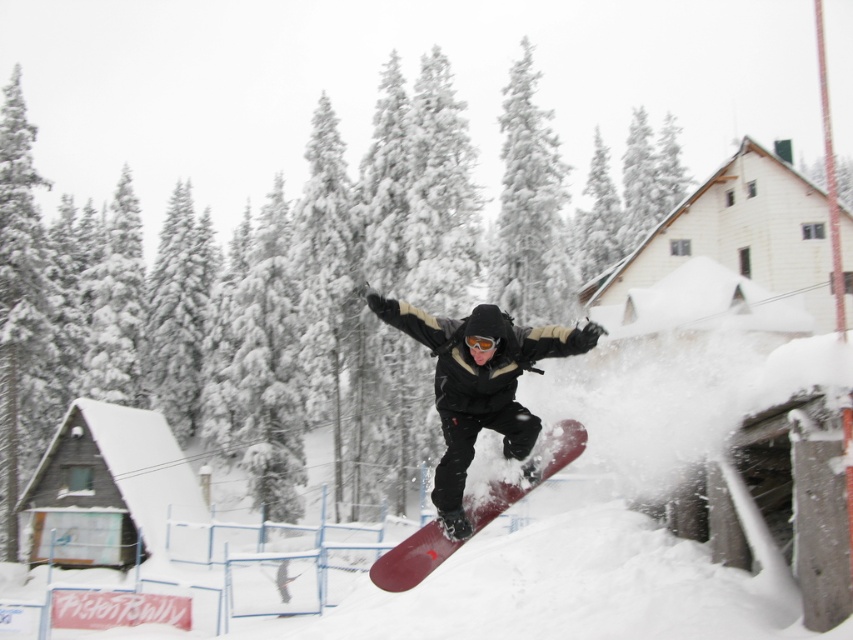
You are a photographer capturing the snowboarder midair. You notice two snowboards in the scene, the matte black snowboard at center and the matte red snowboard at center. Which one appears bigger in the photo?

The matte black snowboard at center appears bigger in the photo because it is larger in size than the matte red snowboard at center.

You are a photographer capturing the snowboarder midair. You notice two snowboards in the frame, the matte black snowboard at center and the matte red snowboard at center. Which snowboard is positioned to the left of the other?

The matte black snowboard at center is positioned to the left of the matte red snowboard at center.